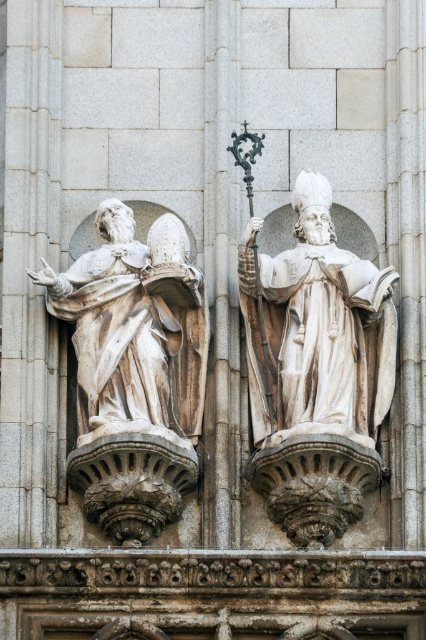
You are standing in front of the two stone statues on the building facade. There are two points marked on the statues. One is at coordinate point (100, 252) and the other is at point (213, 496). Which point is closer to you?

Point (100, 252) is closer to you because it is further to the viewer than point (213, 496).

You are an architect examining the building facade. You need to install a new light fixture above the white marble statue at left and the smooth stone pillar at center. Based on their positions, which object should the light fixture be placed above?

The white marble statue at left is located below the smooth stone pillar at center, so the light fixture should be placed above the smooth stone pillar at center to ensure it is positioned higher than the statue.